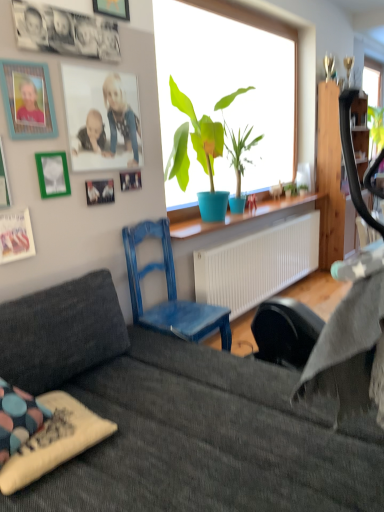
Question: From a real-world perspective, is matte plastic picture frame at upper left, acting as the second picture frame starting from the top, below wooden picture frame at upper left, the 1th picture frame in the top-to-bottom sequence?

Choices:
 (A) no
 (B) yes

Answer: (B)

Question: Considering the relative sizes of matte plastic picture frame at upper left, which is the seventh picture frame from bottom to top, and wooden picture frame at upper left, the 1th picture frame in the top-to-bottom sequence, in the image provided, is matte plastic picture frame at upper left, which is the seventh picture frame from bottom to top, smaller than wooden picture frame at upper left, the 1th picture frame in the top-to-bottom sequence,?

Choices:
 (A) no
 (B) yes

Answer: (A)

Question: Is matte plastic picture frame at upper left, which is the seventh picture frame from bottom to top, far from wooden picture frame at upper left, the 8th picture frame in the bottom-to-top sequence?

Choices:
 (A) no
 (B) yes

Answer: (A)

Question: Can you confirm if matte plastic picture frame at upper left, acting as the second picture frame starting from the top, is wider than wooden picture frame at upper left, the 8th picture frame in the bottom-to-top sequence?

Choices:
 (A) yes
 (B) no

Answer: (B)

Question: Is matte plastic picture frame at upper left, acting as the second picture frame starting from the top, to the right of wooden picture frame at upper left, the 8th picture frame in the bottom-to-top sequence, from the viewer's perspective?

Choices:
 (A) no
 (B) yes

Answer: (A)

Question: Is the depth of matte plastic picture frame at upper left, acting as the second picture frame starting from the top, less than that of wooden picture frame at upper left, the 1th picture frame in the top-to-bottom sequence?

Choices:
 (A) no
 (B) yes

Answer: (B)

Question: Is matte plastic picture frame at upper left, which is the seventh picture frame from bottom to top, at the right side of dark gray fabric couch at lower center?

Choices:
 (A) yes
 (B) no

Answer: (B)

Question: Does matte plastic picture frame at upper left, acting as the second picture frame starting from the top, have a lesser width compared to dark gray fabric couch at lower center?

Choices:
 (A) no
 (B) yes

Answer: (B)

Question: From a real-world perspective, does matte plastic picture frame at upper left, which is the seventh picture frame from bottom to top, stand above dark gray fabric couch at lower center?

Choices:
 (A) yes
 (B) no

Answer: (A)

Question: From the image's perspective, is matte plastic picture frame at upper left, acting as the second picture frame starting from the top, located beneath dark gray fabric couch at lower center?

Choices:
 (A) no
 (B) yes

Answer: (A)

Question: Does matte plastic picture frame at upper left, which is the seventh picture frame from bottom to top, appear on the left side of dark gray fabric couch at lower center?

Choices:
 (A) yes
 (B) no

Answer: (A)

Question: Is matte plastic picture frame at upper left, acting as the second picture frame starting from the top, outside dark gray fabric couch at lower center?

Choices:
 (A) no
 (B) yes

Answer: (B)

Question: Is teal wooden picture frame at upper left, positioned as the 3th picture frame in top-to-bottom order, turned away from matte plastic picture frame at upper left, acting as the second picture frame starting from the top?

Choices:
 (A) yes
 (B) no

Answer: (B)